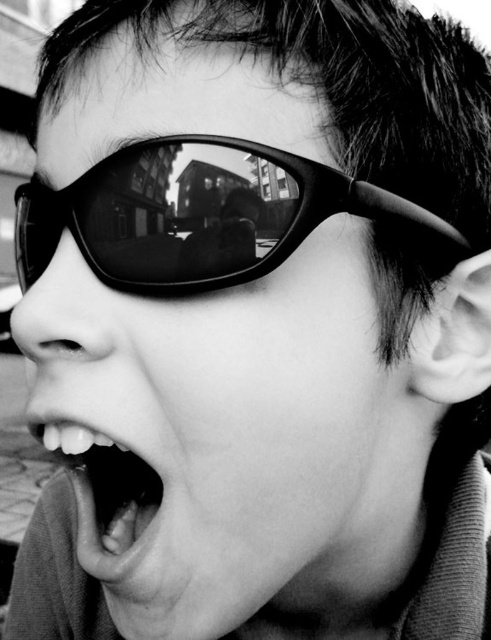
You are a photographer adjusting your camera settings. You notice the black matte sunglasses at upper center is positioned at point (207,216). To ensure the reflection of the urban environment in the sunglasses is clear, should you focus your camera on the sunglasses or on the background buildings?

The black matte sunglasses at upper center is located at point (207,216). To capture the reflection of the urban environment clearly, you should focus on the sunglasses because the reflection is on their surface, which is at that specific point.

You are a photographer trying to focus on the subject in this portrait. Since the black matte sunglasses at upper center and the smooth white teeth at center are both in the frame, which object is closer to you, the photographer?

The black matte sunglasses at upper center are closer to the viewer than the smooth white teeth at center, so the photographer should focus on the black matte sunglasses at upper center.

You are a photographer trying to capture the reflection in the black matte sunglasses at upper center. Since the sunglasses are reflecting an urban environment, where should you position yourself relative to the smooth white teeth at center to ensure the reflection is visible?

The black matte sunglasses at upper center is positioned on the right side of smooth white teeth at center. To capture the reflection in the sunglasses, you should position yourself to the right of the smooth white teeth at center so that the light reflecting off the sunglasses faces your direction.